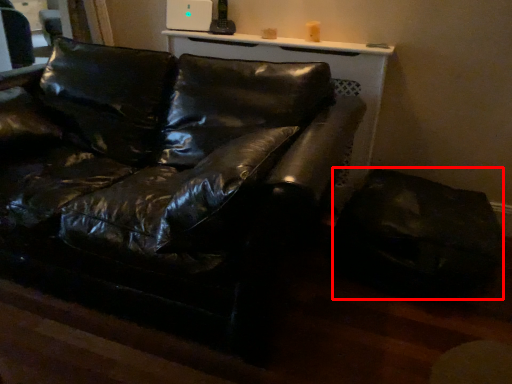
Question: Observing the image, what is the correct spatial positioning of swivel chair (annotated by the red box) in reference to studio couch?

Choices:
 (A) right
 (B) left

Answer: (A)